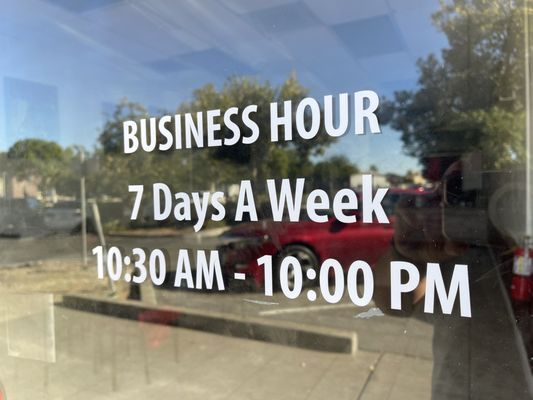
You are a GUI agent. You are given a task and a screenshot of the screen. Output one action in this format:
    pyautogui.click(x=<x>, y=<y>)
    Task: Click on the fire extinguisher at far right of image
    The image size is (533, 400).
    Given the screenshot: What is the action you would take?
    [518, 283]